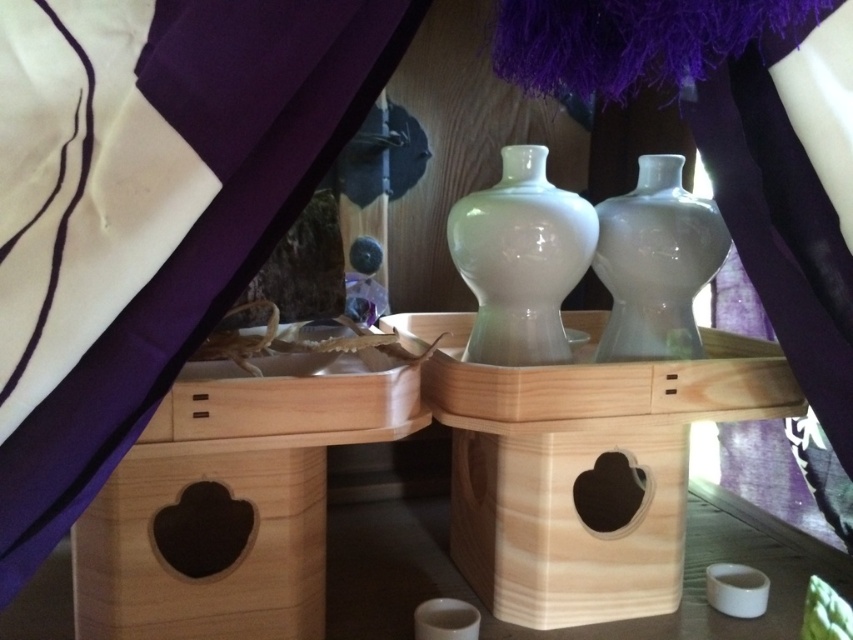
Question: Is natural wood table at center bigger than white glossy vase at center?

Choices:
 (A) yes
 (B) no

Answer: (A)

Question: Among these objects, which one is nearest to the camera?

Choices:
 (A) transparent glass vase at center
 (B) purple fabric curtain at upper left

Answer: (B)

Question: Which point is closer to the camera?

Choices:
 (A) (651, 266)
 (B) (283, 516)
 (C) (492, 324)

Answer: (B)

Question: Is purple fabric curtain at upper left wider than natural wood table at center?

Choices:
 (A) yes
 (B) no

Answer: (B)

Question: Does natural wood table at center lie behind transparent glass vase at center?

Choices:
 (A) no
 (B) yes

Answer: (A)

Question: Among these objects, which one is nearest to the camera?

Choices:
 (A) natural wood table at center
 (B) white glossy vase at center
 (C) purple fabric curtain at upper left
 (D) transparent glass vase at center

Answer: (C)